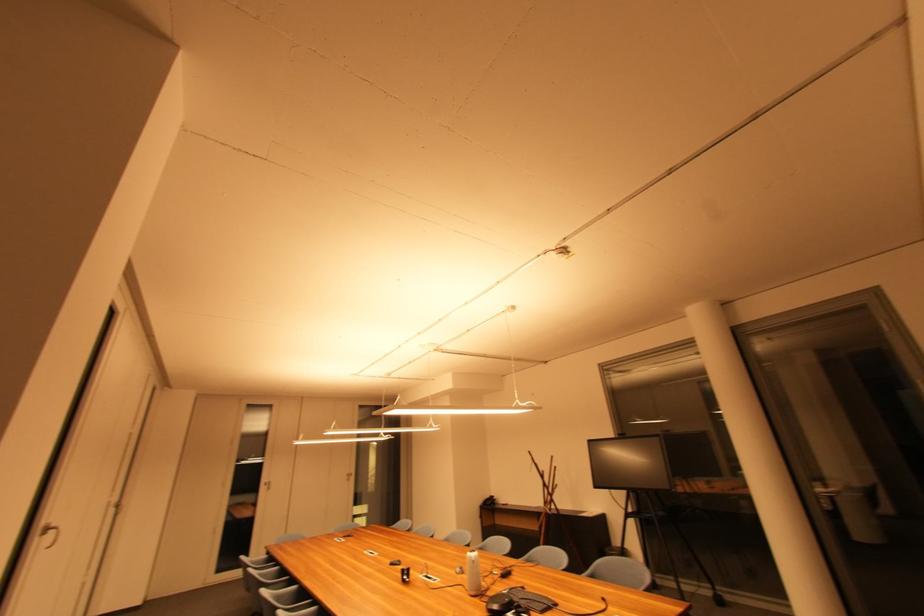
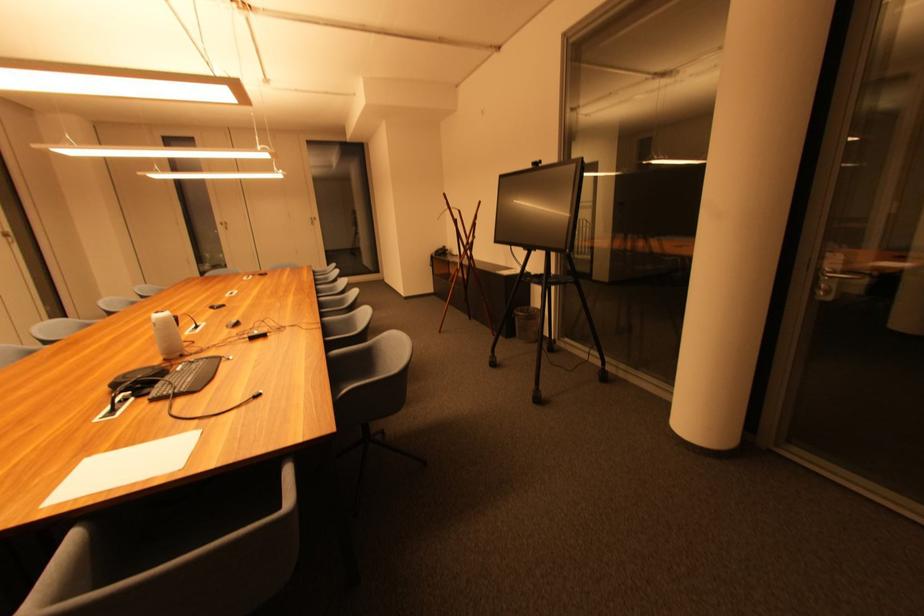
The point at (475, 557) is marked in the first image. Where is the corresponding point in the second image?

(160, 318)